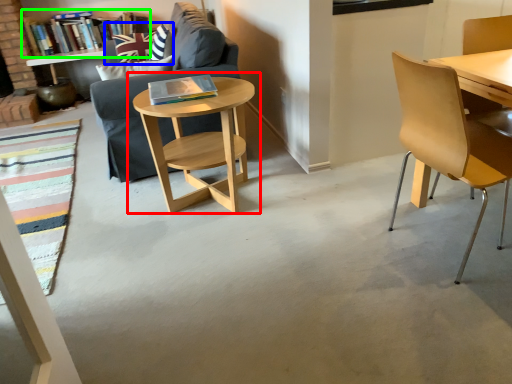
Question: Which is farther away from table (highlighted by a red box)? pillow (highlighted by a blue box) or book (highlighted by a green box)?

Choices:
 (A) pillow
 (B) book

Answer: (B)